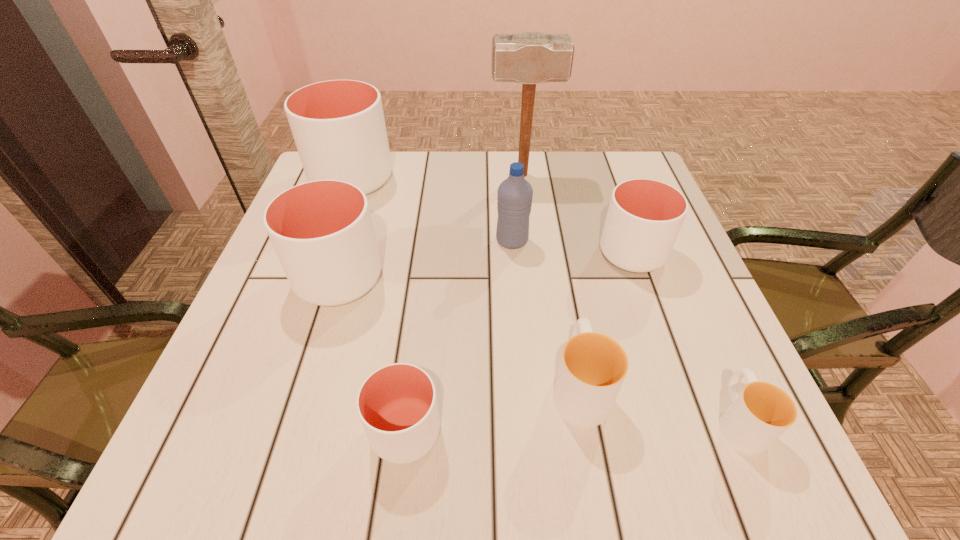
Identify which white cup is the closest to the bigger yellow cup. Please provide its 2D coordinates. Your answer should be formatted as a tuple, i.e. [(x, y)], where the tuple contains the x and y coordinates of a point satisfying the conditions above.

[(397, 404)]

Find the location of a particular element. The width and height of the screenshot is (960, 540). the third closest white cup to the second biggest white cup is located at coordinates (644, 217).

Locate an element on the screen. vacant space that satisfies the following two spatial constraints: 1. on the striking face of the mallet; 2. on the front side of the farthest cup is located at coordinates (523, 179).

You are a GUI agent. You are given a task and a screenshot of the screen. Output one action in this format:
    pyautogui.click(x=<x>, y=<y>)
    Task: Click on the free space that satisfies the following two spatial constraints: 1. on the striking face of the tallest object; 2. with the handle on the side of the bigger yellow cup
    
    Given the screenshot: What is the action you would take?
    pyautogui.click(x=547, y=386)

Where is `vacant point that satisfies the following two spatial constraints: 1. on the striking face of the tallest object; 2. with the handle on the side of the shortest object`? This screenshot has width=960, height=540. vacant point that satisfies the following two spatial constraints: 1. on the striking face of the tallest object; 2. with the handle on the side of the shortest object is located at coordinates (552, 421).